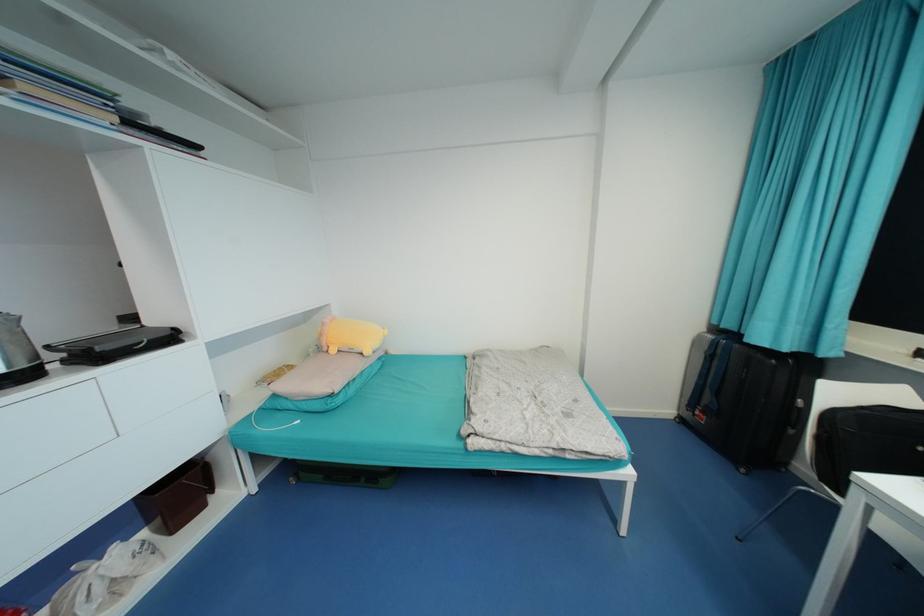
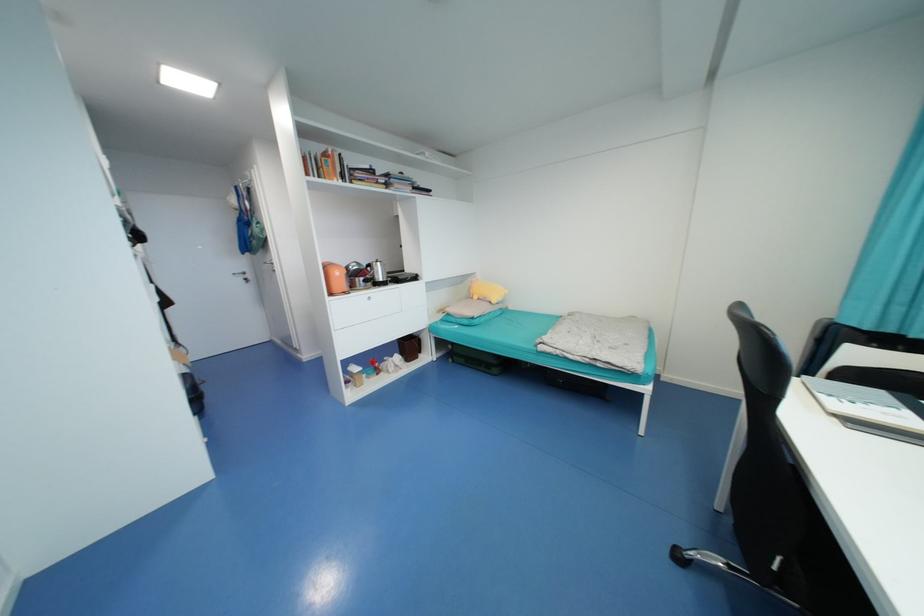
Find the pixel in the second image that matches point (28, 87) in the first image.

(399, 187)